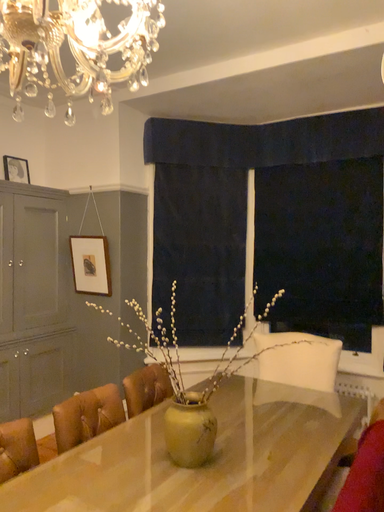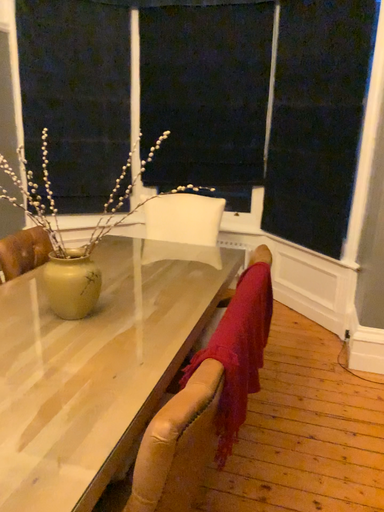
Question: How did the camera likely rotate when shooting the video?

Choices:
 (A) rotated downward
 (B) rotated upward

Answer: (A)